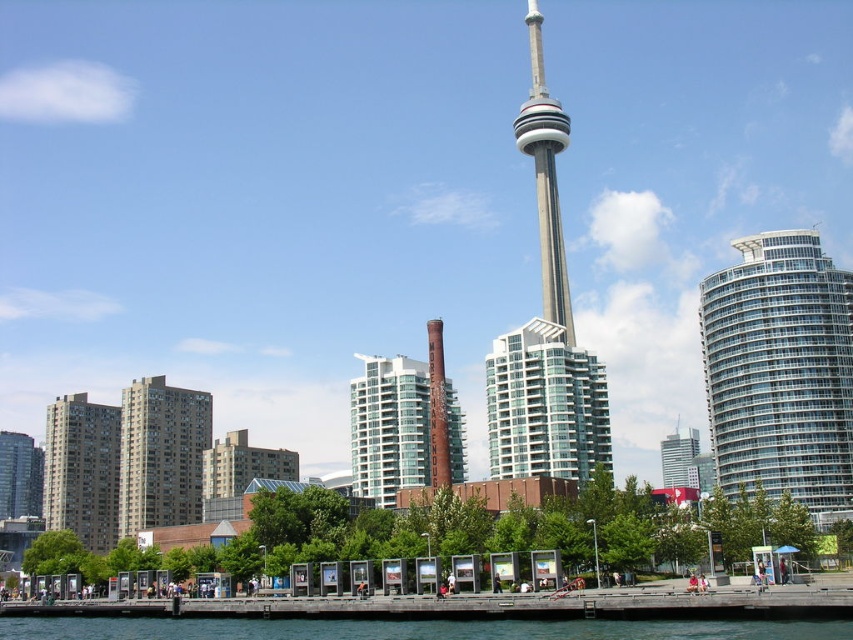
Who is lower down, clear glass skyscraper at right or brick building at center?

brick building at center is below.

Is clear glass skyscraper at right thinner than brick building at center?

Correct, clear glass skyscraper at right's width is less than brick building at center's.

In order to click on clear glass skyscraper at right in this screenshot , I will do `click(780, 372)`.

You are a GUI agent. You are given a task and a screenshot of the screen. Output one action in this format:
    pyautogui.click(x=<x>, y=<y>)
    Task: Click on the clear glass skyscraper at right
    This screenshot has width=853, height=640.
    Given the screenshot: What is the action you would take?
    pyautogui.click(x=780, y=372)

Which is more to the left, brick building at center or glassy steel skyscraper at center?

brick building at center is more to the left.

Between point (202, 515) and point (677, 440), which one is positioned in front?

Positioned in front is point (202, 515).

This screenshot has height=640, width=853. What do you see at coordinates (241, 474) in the screenshot?
I see `brick building at center` at bounding box center [241, 474].

This screenshot has height=640, width=853. What are the coordinates of `brick building at center` in the screenshot? It's located at (241, 474).

Does clear water at lower center have a greater width compared to gray concrete tower at center?

Yes.

Is clear water at lower center further to camera compared to gray concrete tower at center?

No, clear water at lower center is in front of gray concrete tower at center.

Is point (51, 620) positioned behind point (543, 225)?

No, (51, 620) is closer to viewer.

Where is `clear water at lower center`? clear water at lower center is located at coordinates (413, 628).